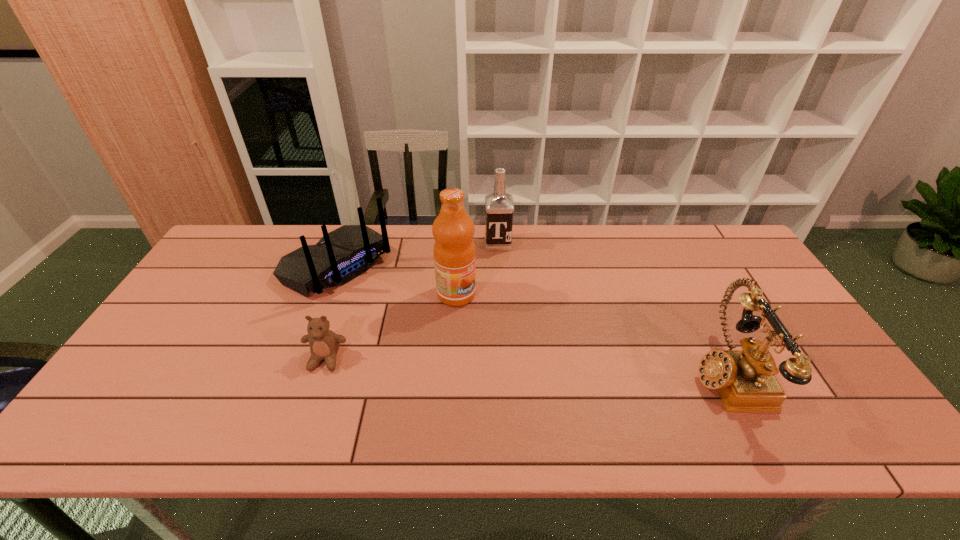
Where is `the shortest object`? The height and width of the screenshot is (540, 960). the shortest object is located at coordinates (324, 344).

Find the location of a particular element. Image resolution: width=960 pixels, height=540 pixels. telephone is located at coordinates (745, 380).

In order to click on fruit juice in this screenshot , I will do pos(454,253).

The height and width of the screenshot is (540, 960). I want to click on the tallest object, so click(454, 253).

What are the coordinates of `vodka` in the screenshot? It's located at (499, 205).

Identify the location of the fourth object from left to right. This screenshot has height=540, width=960. point(499,205).

Locate an element on the screen. router is located at coordinates (343, 254).

The height and width of the screenshot is (540, 960). In order to click on free location located on the dial number of the rightmost object in this screenshot , I will do 584,372.

The width and height of the screenshot is (960, 540). I want to click on vacant space located 0.350m on the dial number of the rightmost object, so click(552, 372).

The width and height of the screenshot is (960, 540). In order to click on vacant space situated 0.230m on the dial number of the rightmost object in this screenshot , I will do 600,372.